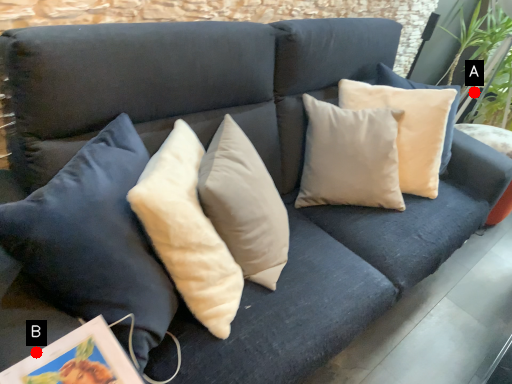
Question: Two points are circled on the image, labeled by A and B beside each circle. Among these points, which one is farthest from the camera?

Choices:
 (A) A is further
 (B) B is further

Answer: (A)